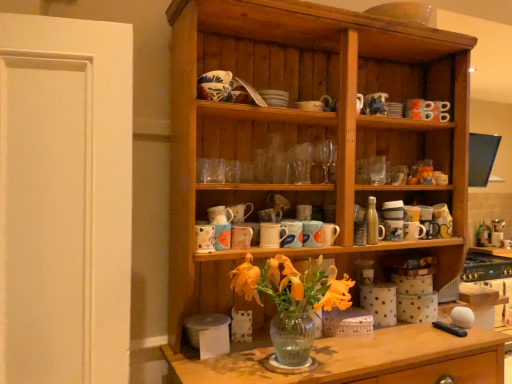
Question: Is blue and white ceramic mug at center, the fourth tableware in the top-to-bottom sequence, inside the boundaries of white matte door at left, or outside?

Choices:
 (A) inside
 (B) outside

Answer: (B)

Question: Considering the positions of blue and white ceramic mug at center, the fourth tableware in the top-to-bottom sequence, and white matte door at left in the image, is blue and white ceramic mug at center, the fourth tableware in the top-to-bottom sequence, wider or thinner than white matte door at left?

Choices:
 (A) thin
 (B) wide

Answer: (A)

Question: Which is nearer to the matte ceramic mug at center, which is the 2th tableware from right to left?

Choices:
 (A) blue and white ceramic mug at center, which appears as the 5th tableware when viewed from the left
 (B) white matte door at left
 (C) metallic silver bottle at center-right
 (D) wooden cabinet at center
 (E) matte ceramic mug at upper right, the first tableware from the right

Answer: (A)

Question: Based on their relative distances, which object is farther from the matte ceramic mug at upper right, the eighth tableware from the left?

Choices:
 (A) matte ceramic mug at center, which is the 7th tableware from top to bottom
 (B) wooden cabinet at center
 (C) matte ceramic mug at center, placed as the seventh tableware when sorted from left to right
 (D) white ceramic mug at center, which ranks as the 3th tableware in top-to-bottom order
 (E) matte ceramic mug at upper center, marked as the sixth tableware in a left-to-right arrangement

Answer: (A)